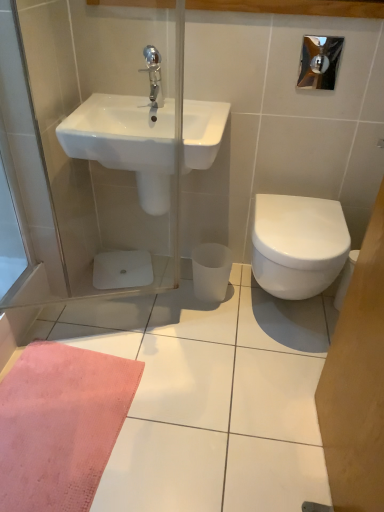
Where is `free space above white glossy bidet at right (from a real-world perspective)`? free space above white glossy bidet at right (from a real-world perspective) is located at coordinates (304, 218).